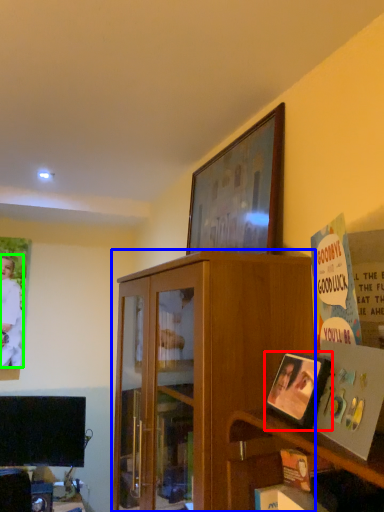
Question: Based on their relative distances, which object is farther from picture frame (highlighted by a red box)? Choose from cabinetry (highlighted by a blue box) and person (highlighted by a green box).

Choices:
 (A) cabinetry
 (B) person

Answer: (B)